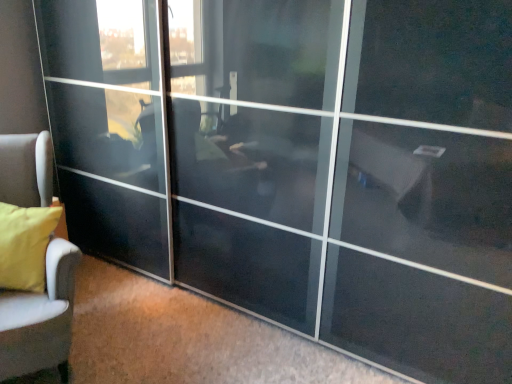
Find the location of a particular element. Image resolution: width=512 pixels, height=384 pixels. free location to the right of yellow fabric chair at left is located at coordinates (158, 334).